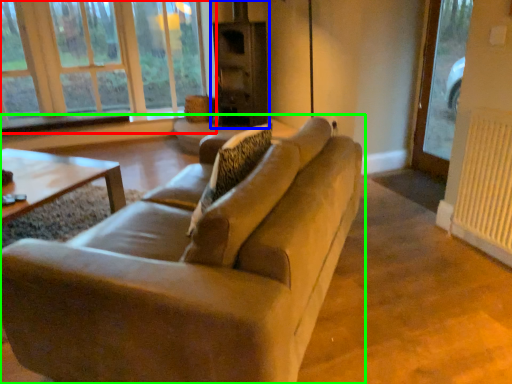
Question: Based on their relative distances, which object is nearer to window (highlighted by a red box)? Choose from fireplace (highlighted by a blue box) and studio couch (highlighted by a green box).

Choices:
 (A) fireplace
 (B) studio couch

Answer: (A)